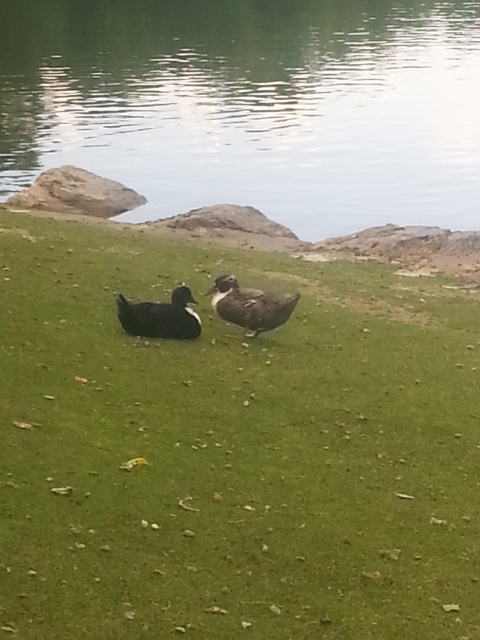
Does point (373, 154) come closer to viewer compared to point (233, 308)?

No, (373, 154) is further to viewer.

Who is taller, green smooth water at center or brown matte duck at center?

green smooth water at center

What are the coordinates of `green smooth water at center` in the screenshot? It's located at (252, 106).

You are a GUI agent. You are given a task and a screenshot of the screen. Output one action in this format:
    pyautogui.click(x=<x>, y=<y>)
    Task: Click on the green smooth water at center
    
    Given the screenshot: What is the action you would take?
    pyautogui.click(x=252, y=106)

Can you confirm if green grassy at center is positioned below brown matte duck at center?

Correct, green grassy at center is located below brown matte duck at center.

Who is lower down, green grassy at center or brown matte duck at center?

Positioned lower is green grassy at center.

Locate an element on the screen. The width and height of the screenshot is (480, 640). green grassy at center is located at coordinates (231, 449).

Is green grassy at center bigger than green smooth water at center?

No, green grassy at center is not bigger than green smooth water at center.

What do you see at coordinates (231, 449) in the screenshot?
I see `green grassy at center` at bounding box center [231, 449].

The height and width of the screenshot is (640, 480). I want to click on green grassy at center, so click(231, 449).